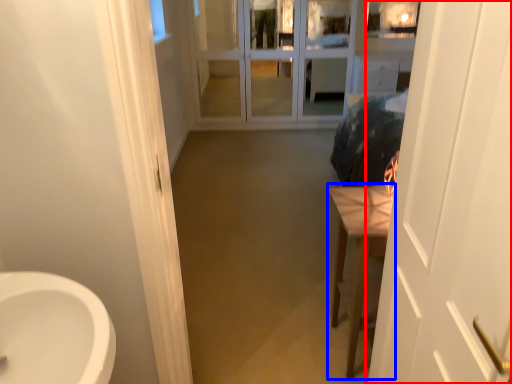
Question: Which object appears farthest to the camera in this image, door (highlighted by a red box) or furniture (highlighted by a blue box)?

Choices:
 (A) door
 (B) furniture

Answer: (B)